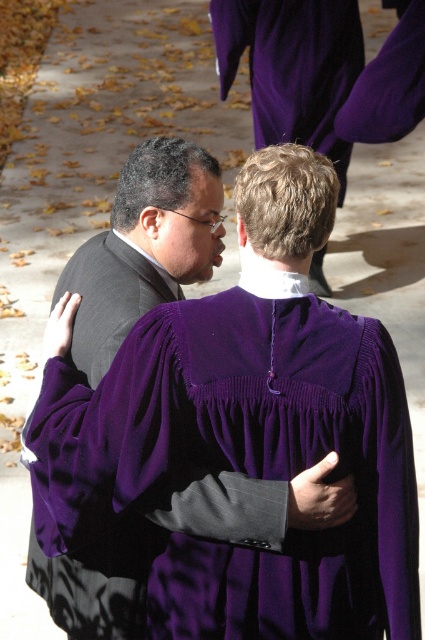
You are attending a graduation ceremony and notice two individuals in purple academic attire. The scene shows a purple velvet gown at center and a velvet purple robe at center. Which one is located to the right?

The purple velvet gown at center is positioned on the right side of the velvet purple robe at center, so the purple velvet gown at center is the one located to the right.

You are an event photographer at a graduation ceremony. You need to capture a photo where both the purple velvet gown at center and the velvet purple robe at center are clearly visible. Based on their positions, which one should you focus on first to ensure it is in the foreground?

The purple velvet gown at center is below the velvet purple robe at center, so you should focus on the velvet purple robe at center first to ensure it is in the foreground since it is higher up and closer to the camera.

You are standing at the center of the paved area surrounded by autumn leaves. You see the point marked at coordinates (241,464). What object is located at that point?

The point at (241,464) indicates the purple velvet gown at center.